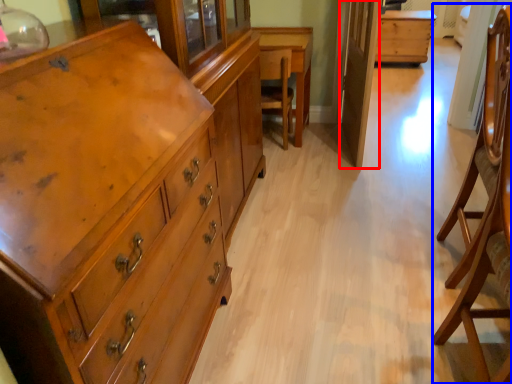
Question: Which of the following is the closest to the observer, glass door (highlighted by a red box) or armchair (highlighted by a blue box)?

Choices:
 (A) glass door
 (B) armchair

Answer: (B)